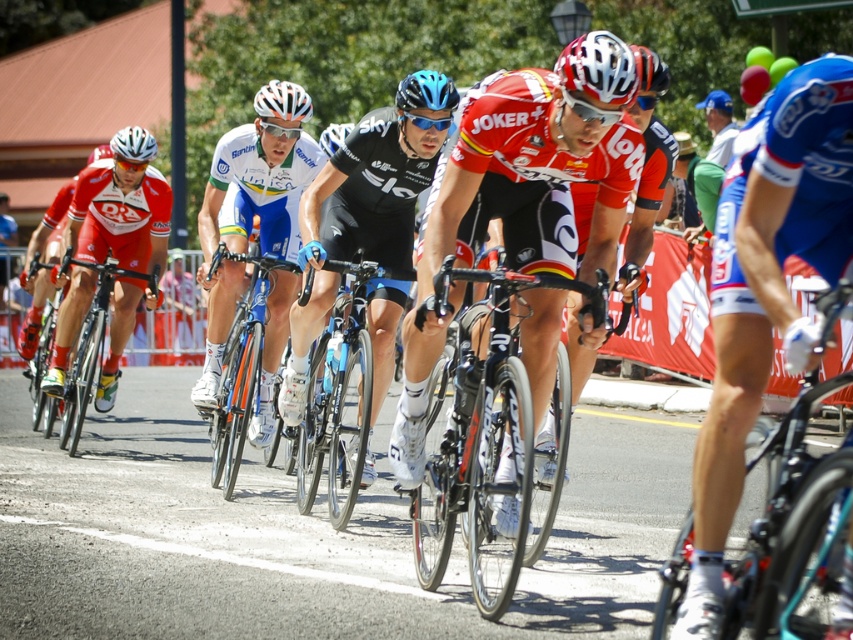
Who is positioned more to the right, teal glossy bicycle at center or shiny black bicycle at left?

teal glossy bicycle at center

Is point (809, 616) positioned before point (97, 339)?

Yes, point (809, 616) is in front of point (97, 339).

The image size is (853, 640). I want to click on teal glossy bicycle at center, so click(x=791, y=531).

Image resolution: width=853 pixels, height=640 pixels. Describe the element at coordinates (598, 67) in the screenshot. I see `white matte bicycle helmet at center` at that location.

Which is behind, point (610, 88) or point (430, 104)?

The point (430, 104) is more distant.

Locate an element on the screen. white matte bicycle helmet at center is located at coordinates (598, 67).

Between white glossy helmet at center and blue matte bicycle helmet at center, which one has more height?

blue matte bicycle helmet at center is taller.

Which is more to the right, white glossy helmet at center or blue matte bicycle helmet at center?

Positioned to the right is blue matte bicycle helmet at center.

Does point (294, 148) come in front of point (418, 100)?

No, it is behind (418, 100).

Where is `white glossy helmet at center`? white glossy helmet at center is located at coordinates (252, 205).